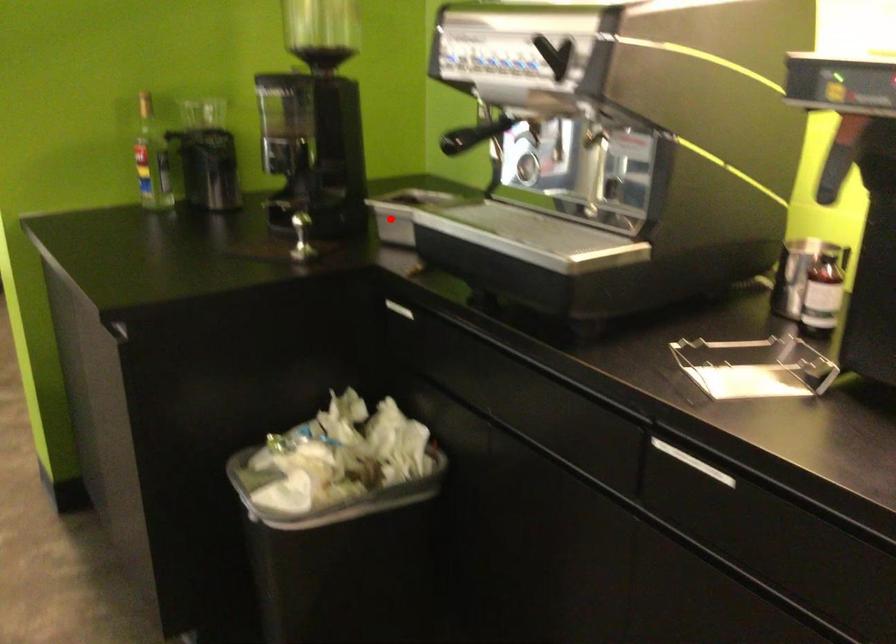
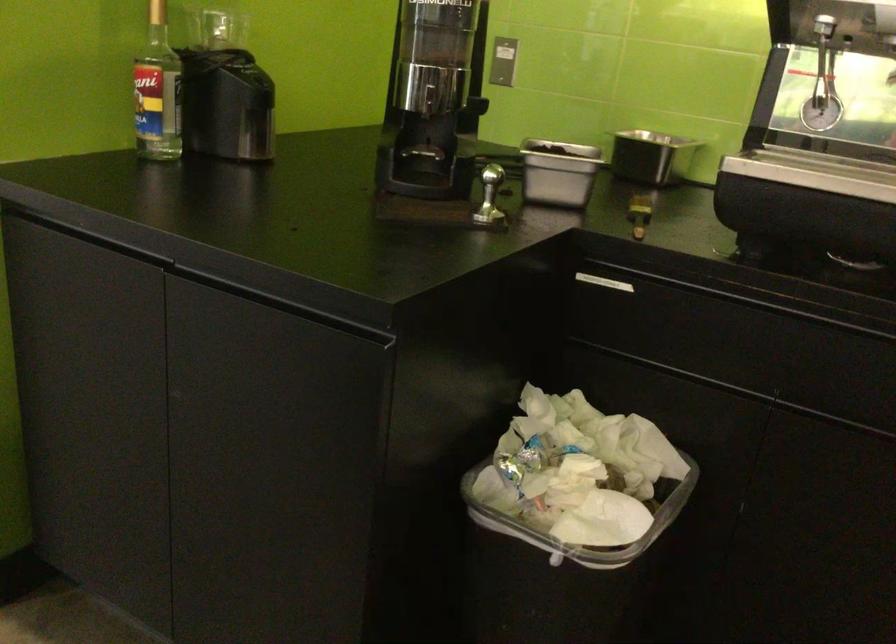
Question: I am providing you with two images of the same scene from different viewpoints. A red point is shown in image1. For the corresponding object point in image2, is it positioned nearer or farther from the camera?

Choices:
 (A) Nearer
 (B) Farther

Answer: (A)